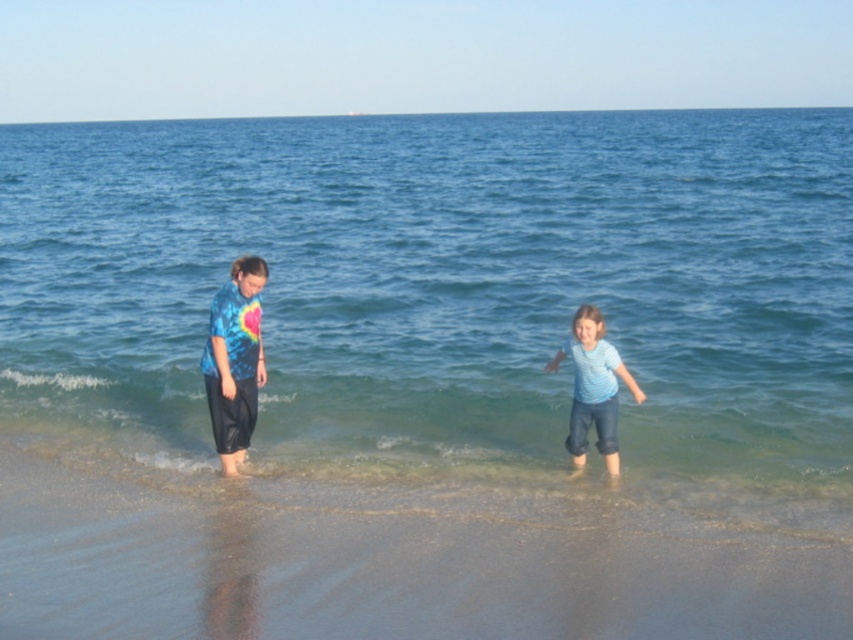
The height and width of the screenshot is (640, 853). In order to click on clear blue water at center in this screenshot , I will do `click(442, 284)`.

Can you confirm if clear blue water at center is positioned above sandy beach at lower center?

Yes, clear blue water at center is above sandy beach at lower center.

Where is `clear blue water at center`? Image resolution: width=853 pixels, height=640 pixels. clear blue water at center is located at coordinates (442, 284).

Find the location of a particular element. clear blue water at center is located at coordinates (442, 284).

Who is positioned more to the right, clear blue water at center or tie-dye fabric pants at left?

Positioned to the right is tie-dye fabric pants at left.

Describe the element at coordinates (442, 284) in the screenshot. I see `clear blue water at center` at that location.

In order to click on clear blue water at center in this screenshot , I will do pyautogui.click(x=442, y=284).

Measure the distance between clear blue water at center and camera.

clear blue water at center and camera are 7.81 meters apart from each other.

Between clear blue water at center and light blue denim jeans at lower center, which one has more height?

With more height is clear blue water at center.

Who is more forward, [138,385] or [618,460]?

Positioned in front is point [618,460].

The height and width of the screenshot is (640, 853). Identify the location of clear blue water at center. (442, 284).